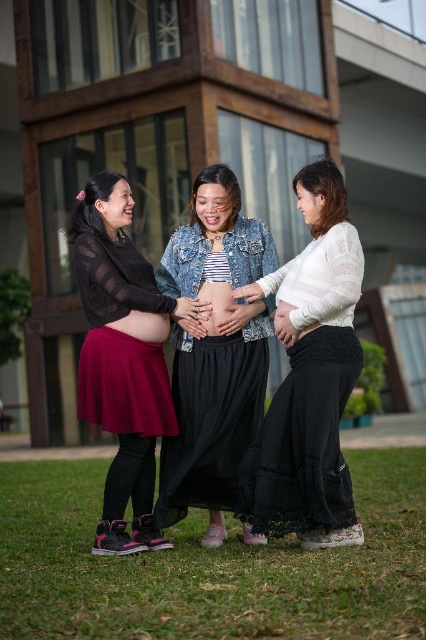
Is white lace skirt at center wider than burgundy knit skirt at left?

Yes.

Which of these two, white lace skirt at center or burgundy knit skirt at left, stands shorter?

Standing shorter between the two is burgundy knit skirt at left.

Image resolution: width=426 pixels, height=640 pixels. Identify the location of white lace skirt at center. (310, 376).

The height and width of the screenshot is (640, 426). I want to click on white lace skirt at center, so click(x=310, y=376).

In the scene shown: Which is more to the left, green grass at lower center or matte black skirt at center?

Positioned to the left is green grass at lower center.

Where is `green grass at lower center`? Image resolution: width=426 pixels, height=640 pixels. green grass at lower center is located at coordinates point(210,564).

At what (x,y) coordinates should I click in order to perform the action: click on green grass at lower center. Please return your answer as a coordinate pair (x, y). Looking at the image, I should click on (210, 564).

From the picture: Is denim jacket at center closer to the viewer compared to matte black skirt at center?

No, denim jacket at center is further to the viewer.

Is point (213, 276) farther from camera compared to point (131, 244)?

No.

I want to click on denim jacket at center, so click(x=213, y=353).